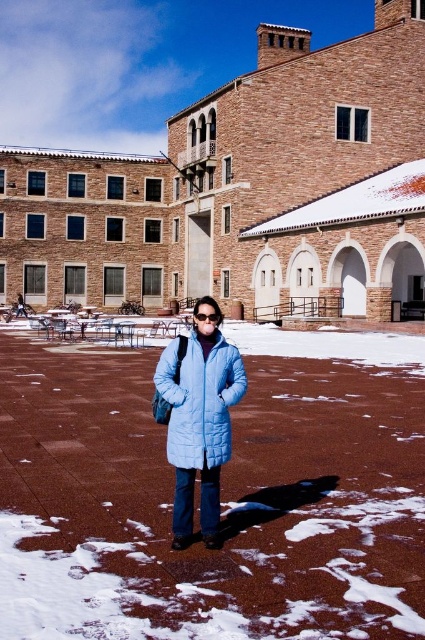
You are a photographer trying to capture the light blue quilted jacket at center and the transparent plastic goggles at center in a single frame. Since the jacket is taller than the goggles, where should you position your camera to ensure both are fully visible in the photo?

Position the camera so that the light blue quilted jacket at center is centered and the transparent plastic goggles at center are placed lower in the frame. Since the jacket is taller, this arrangement ensures both objects are fully visible without cropping either.

You are standing at the entrance of the courtyard and want to find the light blue quilted jacket at center. According to the coordinates provided, in which direction should you walk to reach it?

The light blue quilted jacket at center is located at coordinates point (200, 400). Since the coordinate system is normalized, 0.625 on the x axis means 62.5 percent from the left edge, and 0.471 on the y axis means 47.1 percent from the top edge. Therefore, you should walk towards the right and slightly downward from the entrance to reach the light blue quilted jacket at center.

You are a photographer trying to capture a clear shot of the transparent plastic goggles at center. The light blue quilted jacket at center is in the way. Can you estimate if the jacket is wider than the goggles?

The light blue quilted jacket at center might be wider than transparent plastic goggles at center according to the description, so there is a chance the jacket could block the view of the goggles.